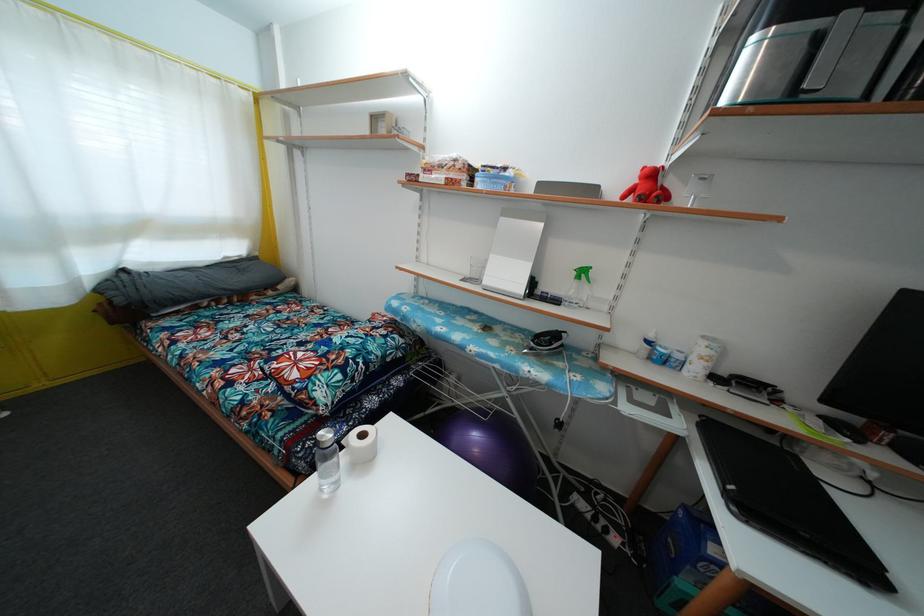
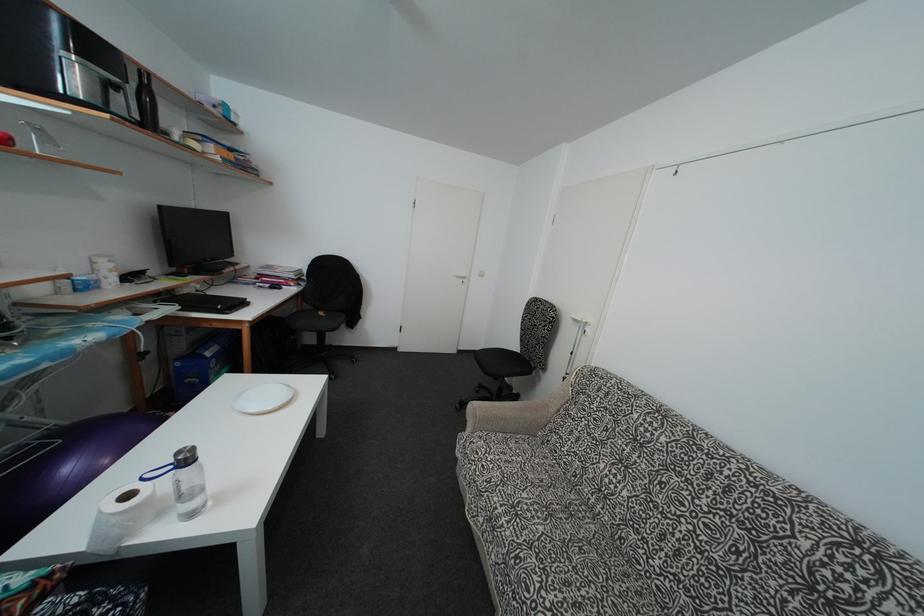
Where in the second image is the point corresponding to point 674,546 from the first image?

(190, 387)